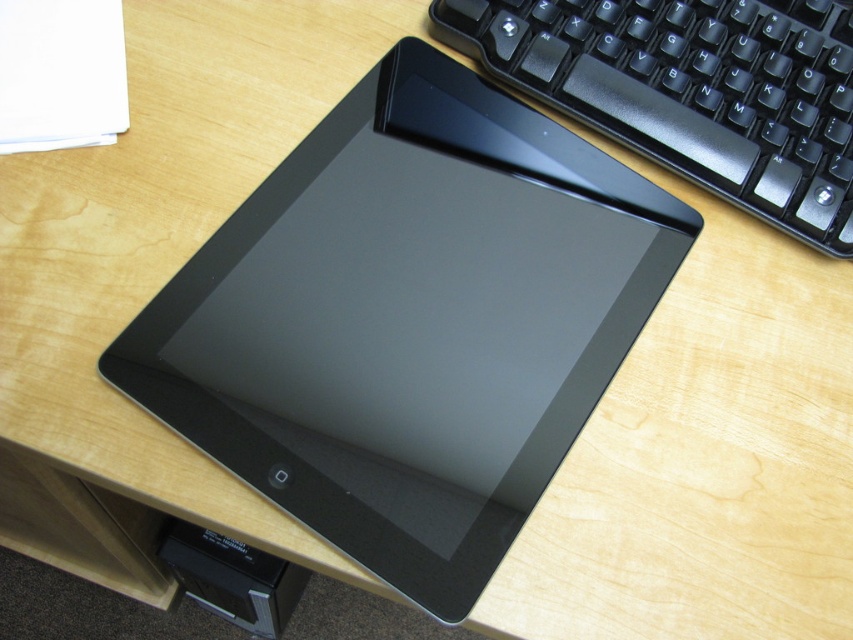
You are standing in front of the workspace and want to place a new keyboard on the desk. The tablet is currently at point (410, 321). Where should you place the new keyboard so it doesn not interfere with the tablet?

The sleek black tablet at center is located at point (410, 321), so you should place the new keyboard away from that coordinate to avoid interference.

Consider the image. You are setting up a new workspace and want to place both the sleek black tablet at center and the black plastic keyboard at upper right on your desk. Given their sizes, which one should you place first to ensure there is enough space for both?

The sleek black tablet at center is taller than the black plastic keyboard at upper right, so you should place the sleek black tablet at center first to ensure there is enough vertical space for both items.

From the picture: You are looking at the workspace setup. There are two points marked on the image, point 1 at coordinates point (572, 300) and point 2 at coordinates point (585, 42). Which of these points is closer to you?

Point (572, 300) is closer to you than point (585, 42).